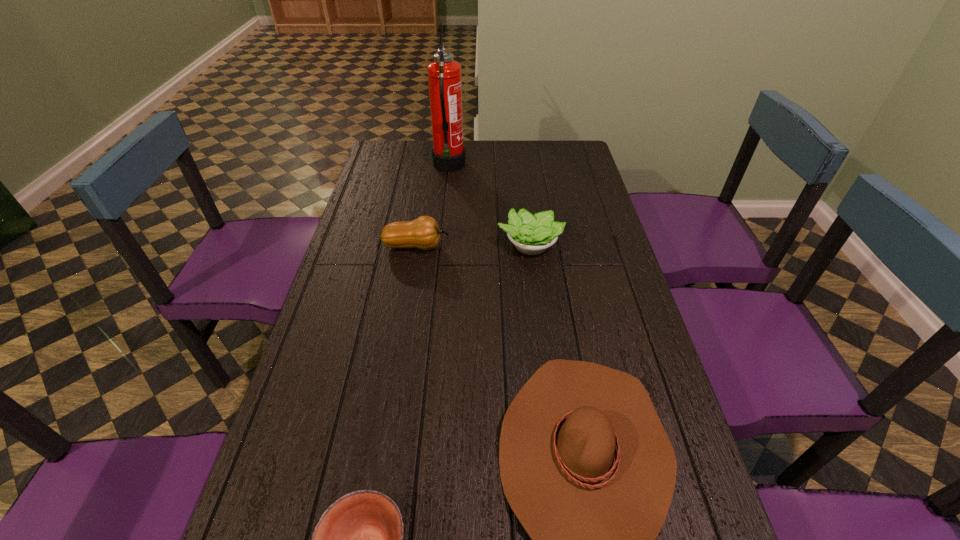
The image size is (960, 540). In the image, there is a desktop. Find the location of `vacant region at the right edge`. vacant region at the right edge is located at coordinates (642, 343).

Identify the location of free point at the far left corner. (372, 164).

This screenshot has width=960, height=540. What are the coordinates of `free space at the far right corner of the desktop` in the screenshot? It's located at (568, 159).

At what (x,y) coordinates should I click in order to perform the action: click on free space between the tallest object and the lettuce. Please return your answer as a coordinate pair (x, y). The height and width of the screenshot is (540, 960). Looking at the image, I should click on (490, 206).

Identify the location of object identified as the third closest to the bowl. The width and height of the screenshot is (960, 540). (423, 233).

Locate which object ranks third in proximity to the bowl. Please provide its 2D coordinates. Your answer should be formatted as a tuple, i.e. [(x, y)], where the tuple contains the x and y coordinates of a point satisfying the conditions above.

[(423, 233)]

In order to click on free space that satisfies the following two spatial constraints: 1. on the front side of the lettuce; 2. on the stem side of the gourd in this screenshot , I will do `click(530, 246)`.